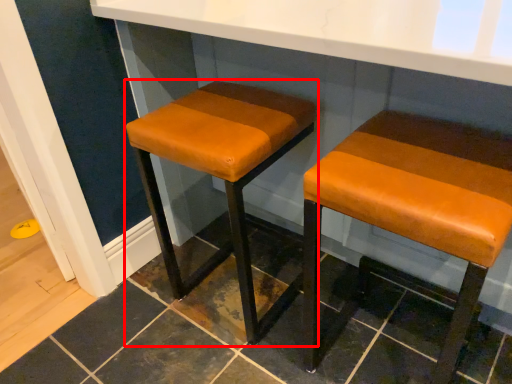
Question: From the image's perspective, what is the correct spatial positioning of stool (annotated by the red box) in reference to stool?

Choices:
 (A) below
 (B) above

Answer: (B)